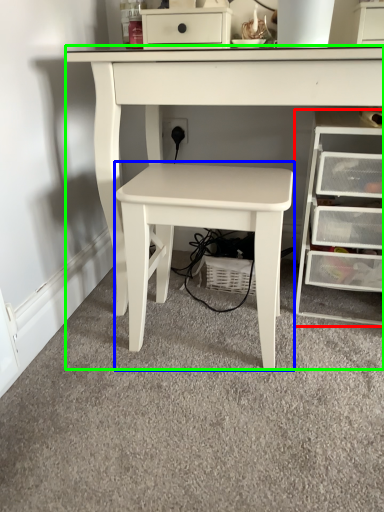
Question: Which object is the farthest from chest of drawers (highlighted by a red box)? Choose among these: table (highlighted by a blue box) or table (highlighted by a green box).

Choices:
 (A) table
 (B) table

Answer: (B)